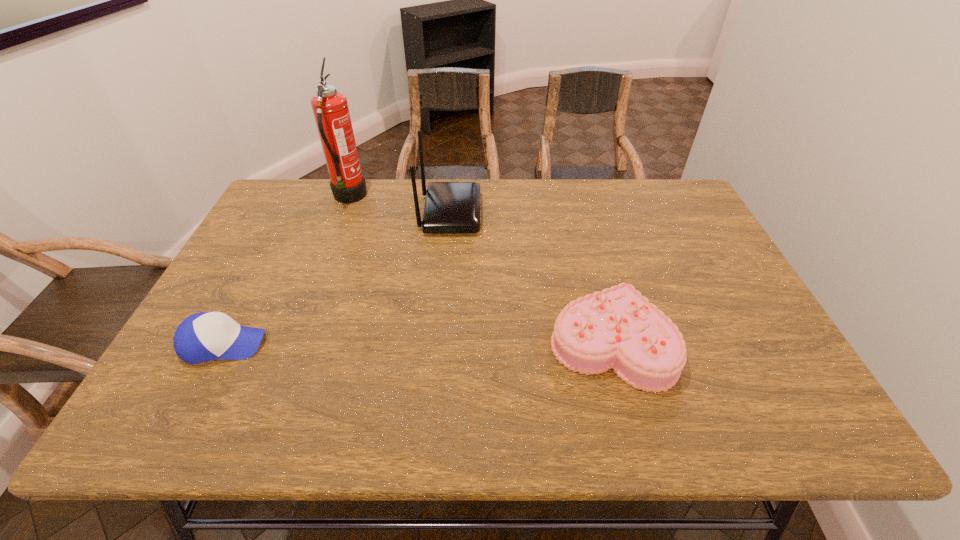
I want to click on fire extinguisher at the far edge, so click(x=330, y=108).

Locate an element on the screen. The width and height of the screenshot is (960, 540). router located at the far edge is located at coordinates (450, 207).

Identify the location of object positioned at the left edge. (205, 336).

Identify the location of vacant space at the far edge. The height and width of the screenshot is (540, 960). [392, 178].

The width and height of the screenshot is (960, 540). Find the location of `free space at the near edge of the desktop`. free space at the near edge of the desktop is located at coordinates (613, 399).

At what (x,y) coordinates should I click in order to perform the action: click on free space at the left edge. Please return your answer as a coordinate pair (x, y). The width and height of the screenshot is (960, 540). Looking at the image, I should click on (260, 235).

Where is `vacant region at the right edge of the desktop`? This screenshot has width=960, height=540. vacant region at the right edge of the desktop is located at coordinates (671, 232).

The width and height of the screenshot is (960, 540). Find the location of `free space at the far left corner of the desktop`. free space at the far left corner of the desktop is located at coordinates (318, 188).

The height and width of the screenshot is (540, 960). Identify the location of free space at the far right corner of the desktop. (678, 187).

This screenshot has height=540, width=960. Find the location of `free spot between the fire extinguisher and the baseball cap`. free spot between the fire extinguisher and the baseball cap is located at coordinates (286, 271).